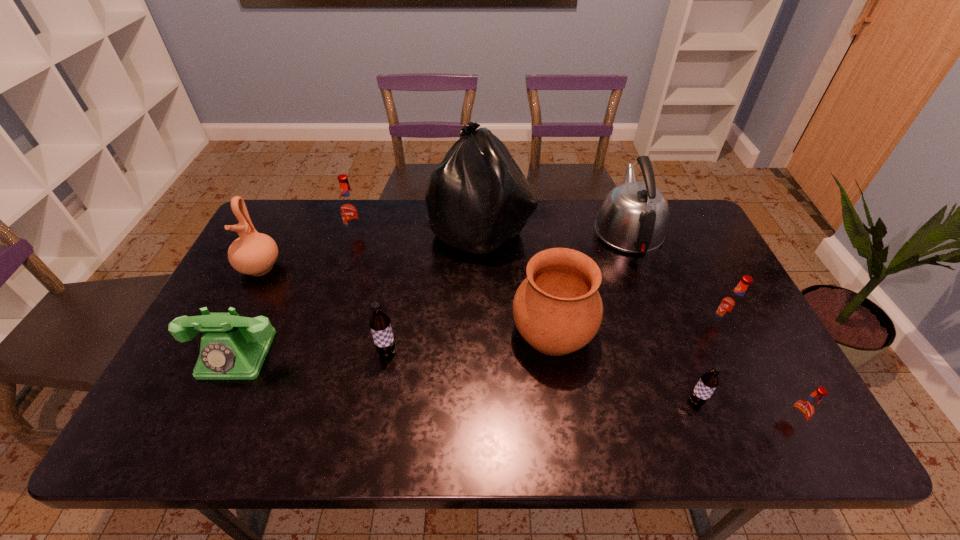
What are the coordinates of `root beer that is the second closest to the kettle` in the screenshot? It's located at (709, 381).

What are the coordinates of `root beer that is the third closest to the second root beer from left to right` in the screenshot? It's located at (731, 306).

Identify which red root beer is located as the second nearest to the leftmost root beer. Please provide its 2D coordinates. Your answer should be formatted as a tuple, i.e. [(x, y)], where the tuple contains the x and y coordinates of a point satisfying the conditions above.

[(804, 408)]

Select which red root beer appears as the closest to the tallest object. Please provide its 2D coordinates. Your answer should be formatted as a tuple, i.e. [(x, y)], where the tuple contains the x and y coordinates of a point satisfying the conditions above.

[(350, 209)]

Find the location of a particular element. The width and height of the screenshot is (960, 540). vacant position in the image that satisfies the following two spatial constraints: 1. on the dial of the rightmost root beer; 2. on the right side of the telephone is located at coordinates (205, 422).

The image size is (960, 540). I want to click on vacant area that satisfies the following two spatial constraints: 1. on the spout of the left pottery; 2. on the left side of the smaller brown root beer, so click(x=192, y=401).

Where is `vacant space that satisfies the following two spatial constraints: 1. on the dial of the nearest red root beer; 2. on the left side of the green telephone`? The width and height of the screenshot is (960, 540). vacant space that satisfies the following two spatial constraints: 1. on the dial of the nearest red root beer; 2. on the left side of the green telephone is located at coordinates (205, 422).